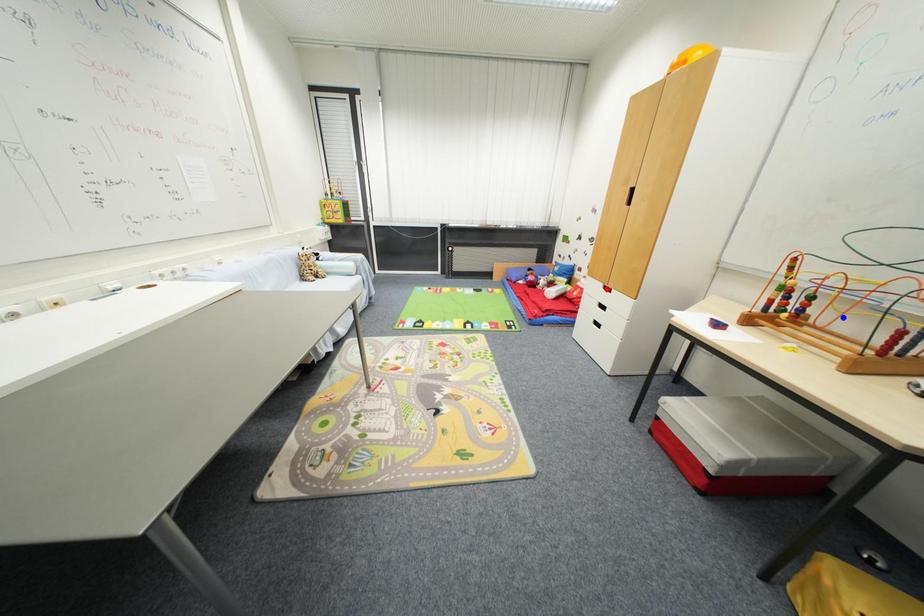
Question: In the image, two points are highlighted. Which point is nearer to the camera? Reply with the corresponding letter.

Choices:
 (A) blue point
 (B) red point

Answer: (A)